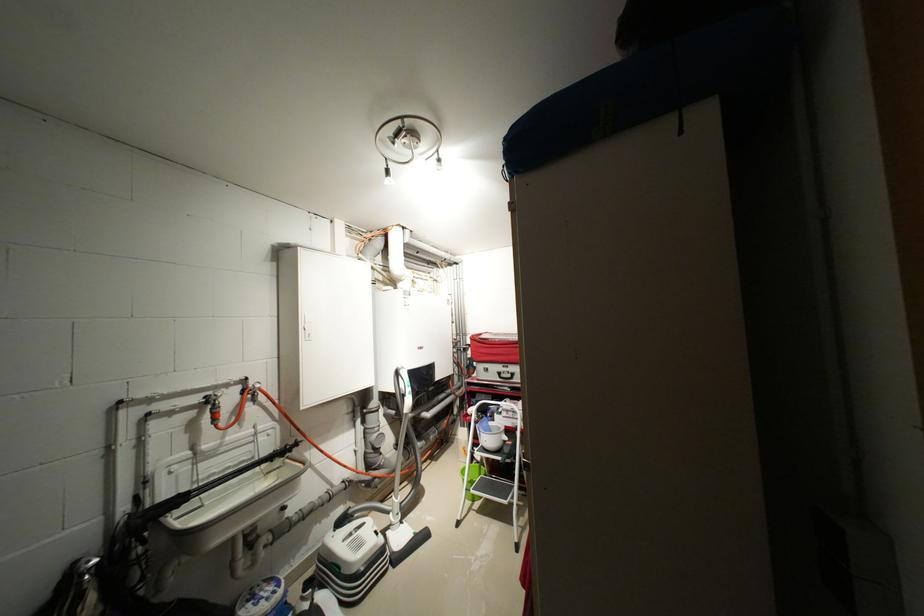
This screenshot has height=616, width=924. What do you see at coordinates (264, 431) in the screenshot?
I see `the sprayer wand trigger` at bounding box center [264, 431].